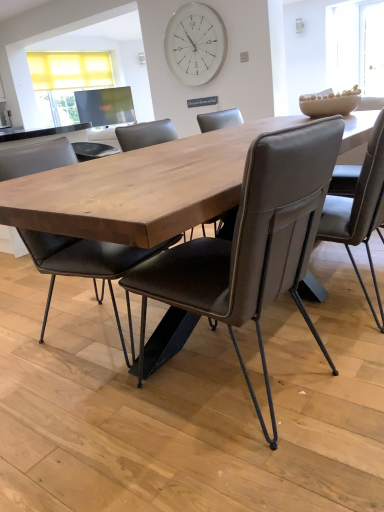
Question: Is white glass clock at upper center positioned before leather-like chair at center, arranged as the first chair when viewed from the right?

Choices:
 (A) no
 (B) yes

Answer: (A)

Question: Could you tell me if white glass clock at upper center is facing leather-like chair at center, arranged as the first chair when viewed from the right?

Choices:
 (A) yes
 (B) no

Answer: (B)

Question: From the image's perspective, is white glass clock at upper center above leather-like chair at center, arranged as the first chair when viewed from the right?

Choices:
 (A) no
 (B) yes

Answer: (B)

Question: From a real-world perspective, is white glass clock at upper center physically above leather-like chair at center, arranged as the first chair when viewed from the right?

Choices:
 (A) no
 (B) yes

Answer: (B)

Question: Considering the relative sizes of white glass clock at upper center and leather-like chair at center, arranged as the first chair when viewed from the right, in the image provided, is white glass clock at upper center shorter than leather-like chair at center, arranged as the first chair when viewed from the right,?

Choices:
 (A) yes
 (B) no

Answer: (A)

Question: Is white glass clock at upper center thinner than leather-like chair at center, arranged as the first chair when viewed from the right?

Choices:
 (A) no
 (B) yes

Answer: (B)

Question: Is brown leather chair at center, marked as the second chair in a left-to-right arrangement, not close to leather-like chair at center, placed as the 3th chair when sorted from left to right?

Choices:
 (A) yes
 (B) no

Answer: (B)

Question: From the image's perspective, is brown leather chair at center, which is the 2th chair from right to left, beneath leather-like chair at center, placed as the 3th chair when sorted from left to right?

Choices:
 (A) yes
 (B) no

Answer: (A)

Question: Considering the relative positions of brown leather chair at center, which is the 2th chair from right to left, and leather-like chair at center, placed as the 3th chair when sorted from left to right, in the image provided, is brown leather chair at center, which is the 2th chair from right to left, to the right of leather-like chair at center, placed as the 3th chair when sorted from left to right, from the viewer's perspective?

Choices:
 (A) yes
 (B) no

Answer: (B)

Question: Can you confirm if brown leather chair at center, which is the 2th chair from right to left, is bigger than leather-like chair at center, placed as the 3th chair when sorted from left to right?

Choices:
 (A) yes
 (B) no

Answer: (A)

Question: Is brown leather chair at center, marked as the second chair in a left-to-right arrangement, taller than leather-like chair at center, placed as the 3th chair when sorted from left to right?

Choices:
 (A) yes
 (B) no

Answer: (A)

Question: Can you confirm if brown leather chair at center, marked as the second chair in a left-to-right arrangement, is smaller than leather-like chair at center, arranged as the first chair when viewed from the right?

Choices:
 (A) yes
 (B) no

Answer: (B)

Question: Can you confirm if white glass clock at upper center is wider than brown leather chair at center, marked as the second chair in a left-to-right arrangement?

Choices:
 (A) yes
 (B) no

Answer: (B)